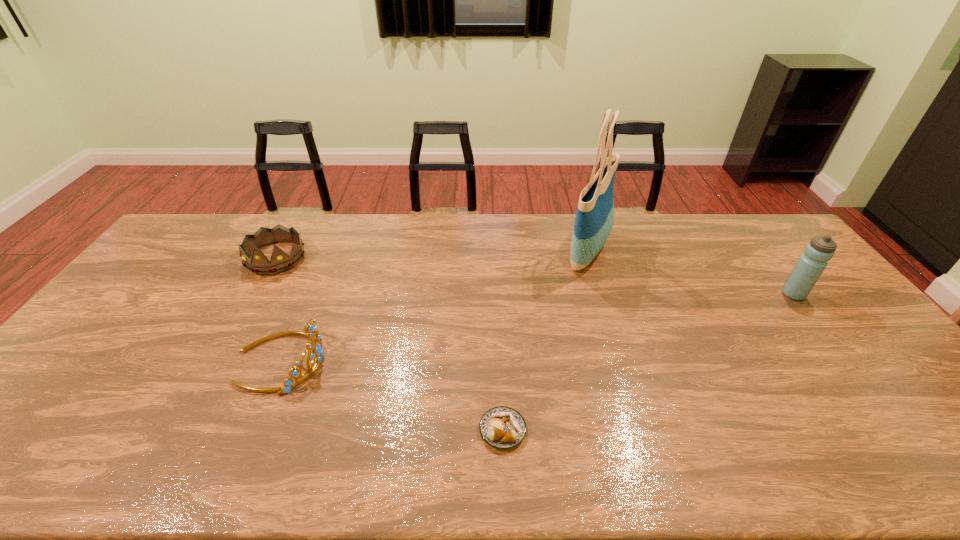
Find the location of `the tallest object`. the tallest object is located at coordinates coord(594,219).

This screenshot has width=960, height=540. What are the coordinates of `tote bag` in the screenshot? It's located at (594, 219).

Where is `water bottle`? The height and width of the screenshot is (540, 960). water bottle is located at coordinates (811, 264).

Where is `the second tallest object`? the second tallest object is located at coordinates (811, 264).

Identify the location of the farther tiara. This screenshot has height=540, width=960. (280, 261).

Image resolution: width=960 pixels, height=540 pixels. I want to click on the nearer tiara, so click(x=317, y=352).

I want to click on the nearest object, so click(x=501, y=427).

This screenshot has width=960, height=540. What are the coordinates of `the shortest object` in the screenshot? It's located at (501, 427).

Find the location of `blank area located 0.170m on the front of the tallest object`. blank area located 0.170m on the front of the tallest object is located at coordinates (608, 319).

The height and width of the screenshot is (540, 960). I want to click on free space located 0.290m on the left of the second tallest object, so click(689, 294).